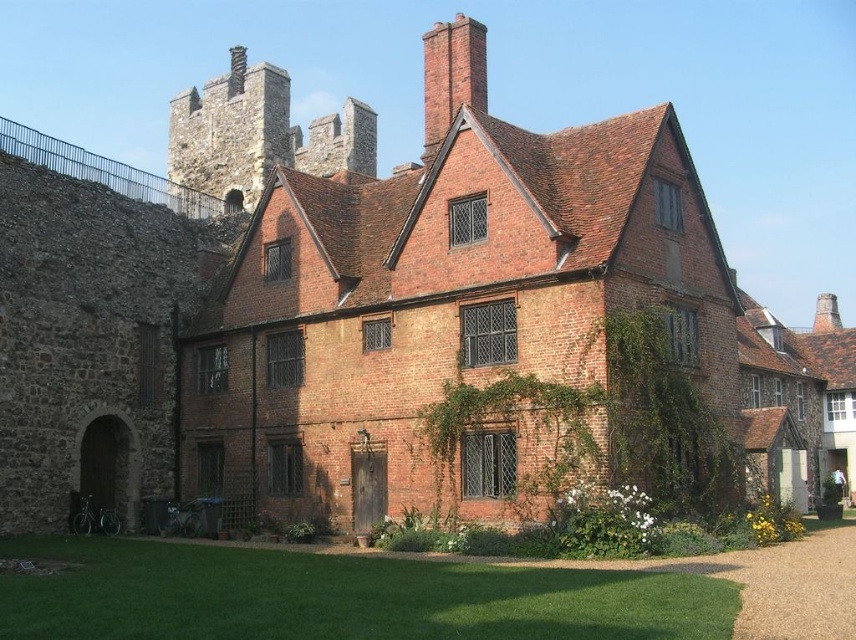
You are standing in front of the historic brick building and want to take a closer look at the stone brick tower at upper left and the brick chimney at upper center. Which object will you reach first as you walk towards the building?

You will reach the stone brick tower at upper left first because it is closer to you than the brick chimney at upper center, as it is further away.

You are standing at the entrance of the historic brick building and see the point marked as point (337, 596). What type of terrain is located at that point?

The point (337, 596) corresponds to the green grass at lower center, which is a well maintained garden area with lush green grass.